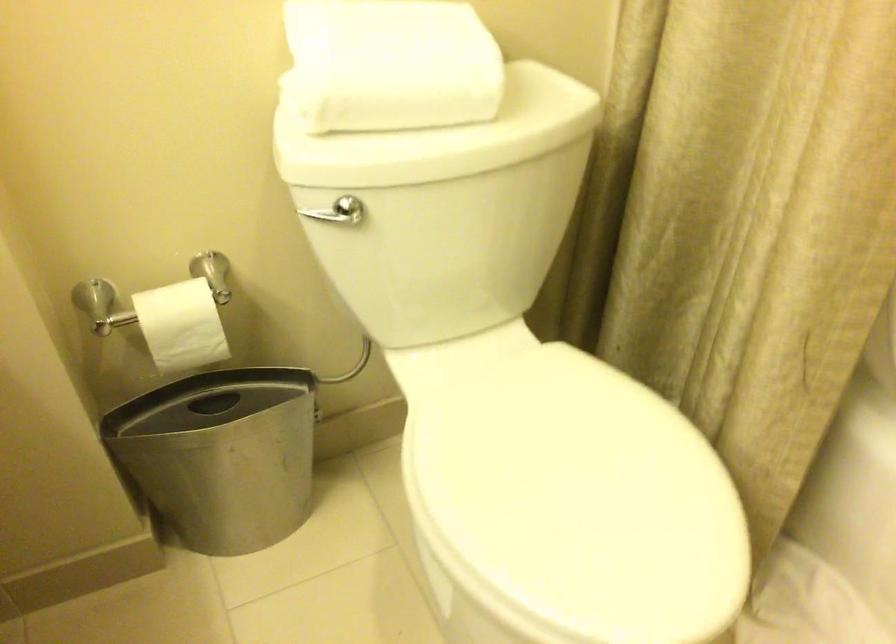
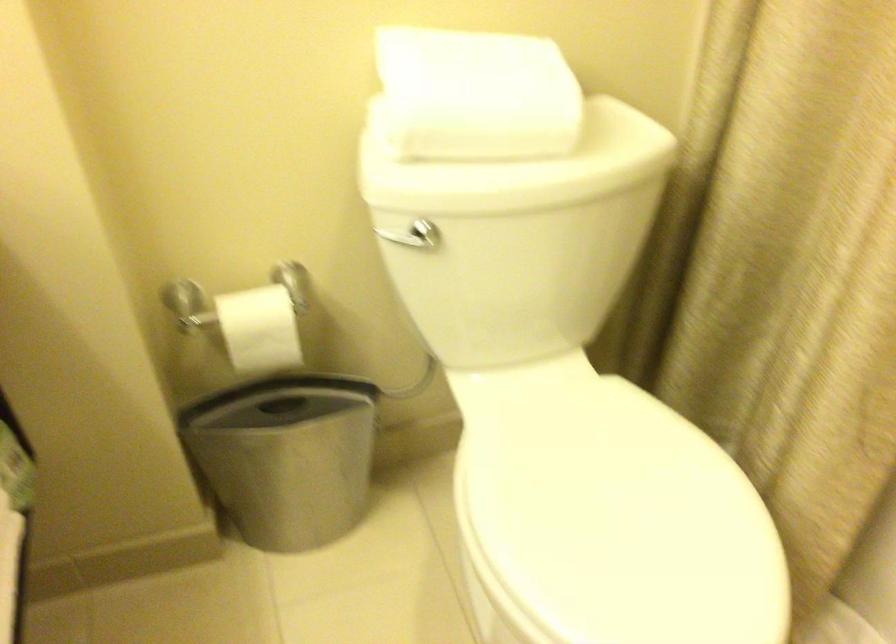
Find the pixel in the second image that matches point (183, 323) in the first image.

(259, 328)